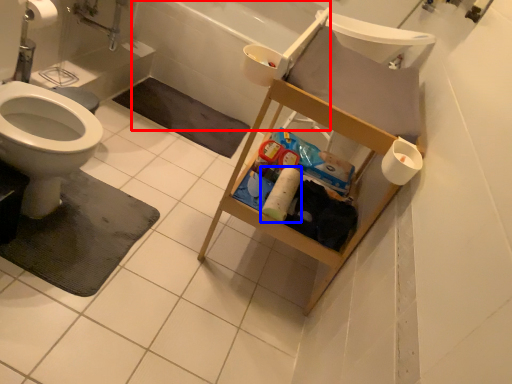
Question: Which object appears farthest to the camera in this image, bath (highlighted by a red box) or toilet paper (highlighted by a blue box)?

Choices:
 (A) bath
 (B) toilet paper

Answer: (A)